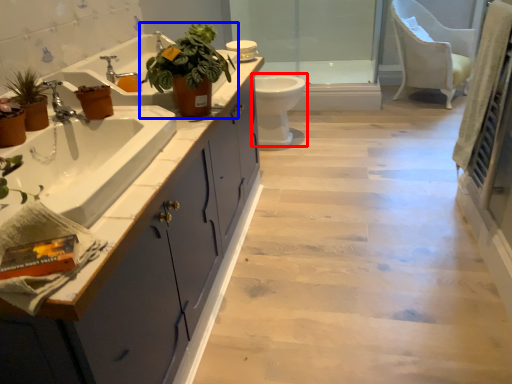
Question: Which of the following is the closest to the observer, toilet (highlighted by a red box) or houseplant (highlighted by a blue box)?

Choices:
 (A) toilet
 (B) houseplant

Answer: (B)